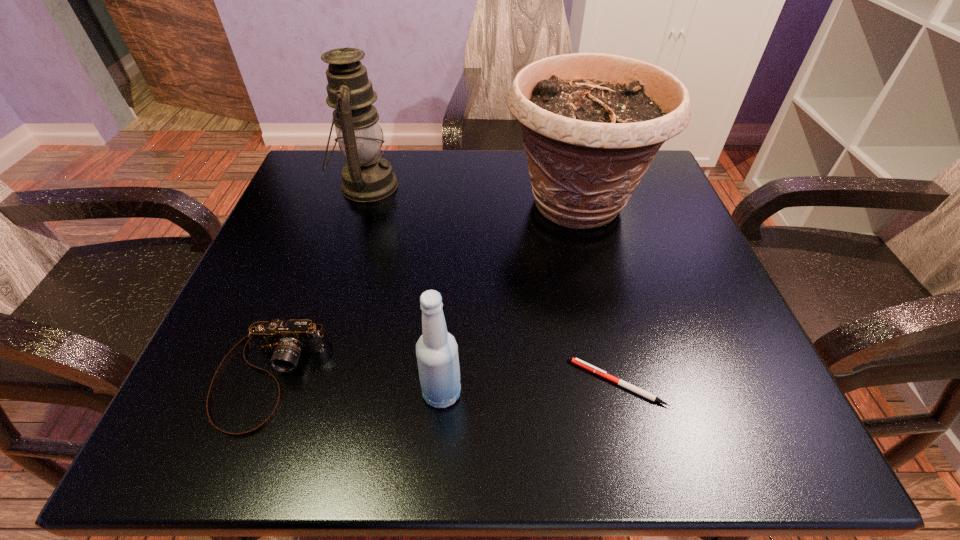
This screenshot has height=540, width=960. What are the coordinates of `object identified as the fourth closest to the oil lamp` in the screenshot? It's located at (602, 373).

Select which object appears as the fourth closest to the bottle. Please provide its 2D coordinates. Your answer should be formatted as a tuple, i.e. [(x, y)], where the tuple contains the x and y coordinates of a point satisfying the conditions above.

[(367, 177)]

Identify the location of free space in the image that satisfies the following two spatial constraints: 1. on the front-facing side of the bottle; 2. on the right side of the fourth tallest object. The height and width of the screenshot is (540, 960). (262, 393).